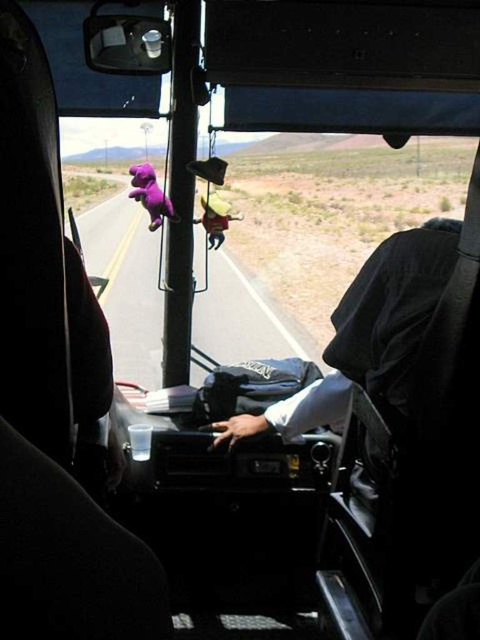
You are sitting in the front passenger seat of the bus and notice two points marked on the windshield. The first point is at coordinates point (151, 177) and the second is at point (228, 225). Which point appears closer to you?

Point (151, 177) is closer to the viewer than point (228, 225), so the first point appears closer to you.

You are a passenger in the vehicle and want to place a 2.5 inch wide phone between the purple matte dinosaur at center and the yellow fabric stuffed animal at center on the dashboard. Can the phone fit between them without overlapping either toy?

The purple matte dinosaur at center and yellow fabric stuffed animal at center are 8.66 inches apart from each other. Since the phone is only 2.5 inches wide, there is enough space between them to place the phone without overlapping either toy.

You are a passenger in the vehicle and want to take a photo of the purple matte dinosaur at center with your camera. The camera is placed on the dashboard. Can you reach the camera to take the photo without moving from your seat?

The purple matte dinosaur at center and camera are 2.41 meters apart from each other, so it is unlikely you can reach the camera to take the photo without moving from your seat since the distance is quite large.